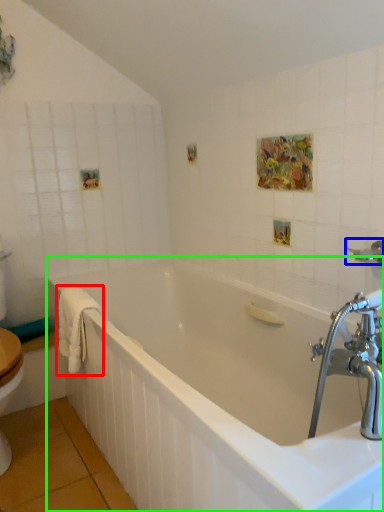
Question: Estimate the real-world distances between objects in this image. Which object is farther from bath towel (highlighted by a red box), shower (highlighted by a blue box) or bathtub (highlighted by a green box)?

Choices:
 (A) shower
 (B) bathtub

Answer: (A)